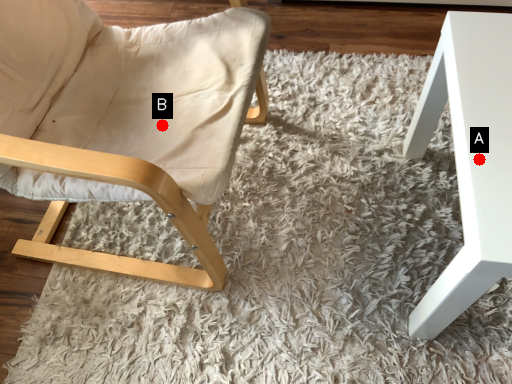
Question: Two points are circled on the image, labeled by A and B beside each circle. Which of the following is the farthest from the observer?

Choices:
 (A) A is further
 (B) B is further

Answer: (B)